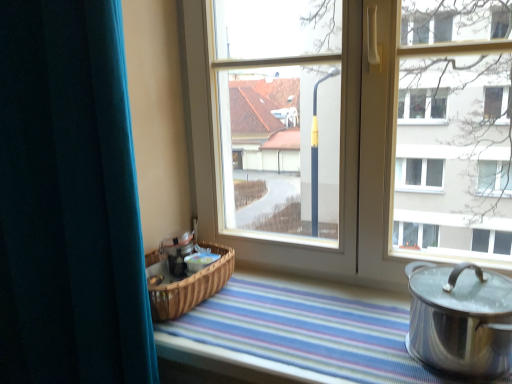
Find the location of a particular element. vacant area in front of transparent glass window at center is located at coordinates (328, 327).